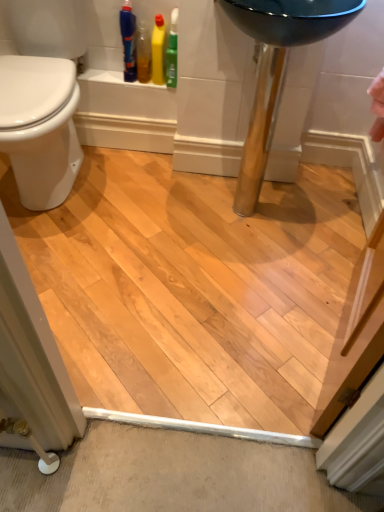
Question: Is white glossy bidet at left taller or shorter than blue plastic bottle at upper left?

Choices:
 (A) tall
 (B) short

Answer: (A)

Question: From a real-world perspective, is white glossy bidet at left physically located above or below blue plastic bottle at upper left?

Choices:
 (A) below
 (B) above

Answer: (A)

Question: Considering the real-world distances, which object is farthest from the translucent plastic bottle at upper left, positioned as the second cleaning product in right-to-left order?

Choices:
 (A) white glossy bidet at left
 (B) blue plastic bottle at upper left
 (C) yellow glossy bottle at upper left, marked as the 1th cleaning product in a right-to-left arrangement

Answer: (A)

Question: Estimate the real-world distances between objects in this image. Which object is farther from the translucent plastic bottle at upper left, the first cleaning product when ordered from left to right?

Choices:
 (A) blue plastic bottle at upper left
 (B) white glossy bidet at left
 (C) yellow glossy bottle at upper left, marked as the 1th cleaning product in a right-to-left arrangement

Answer: (B)